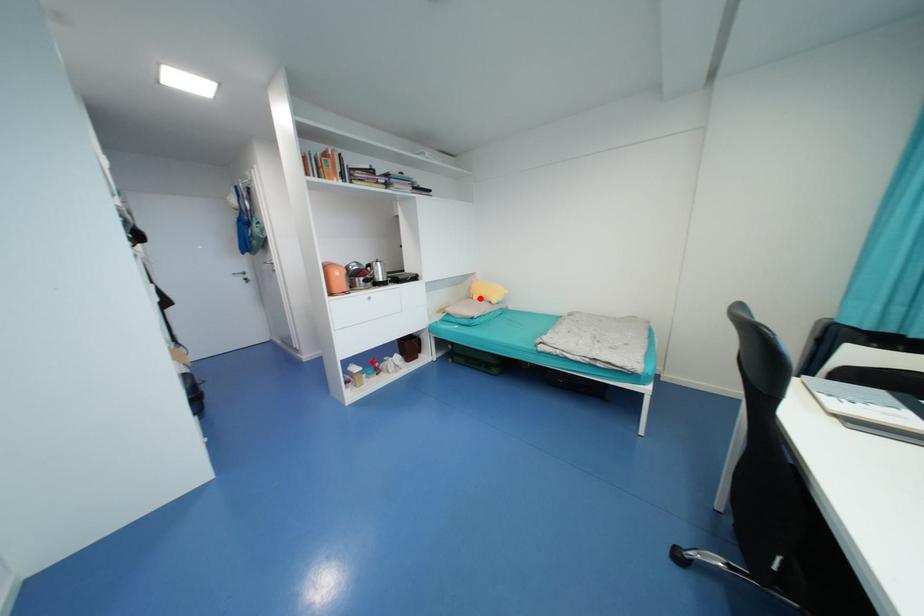
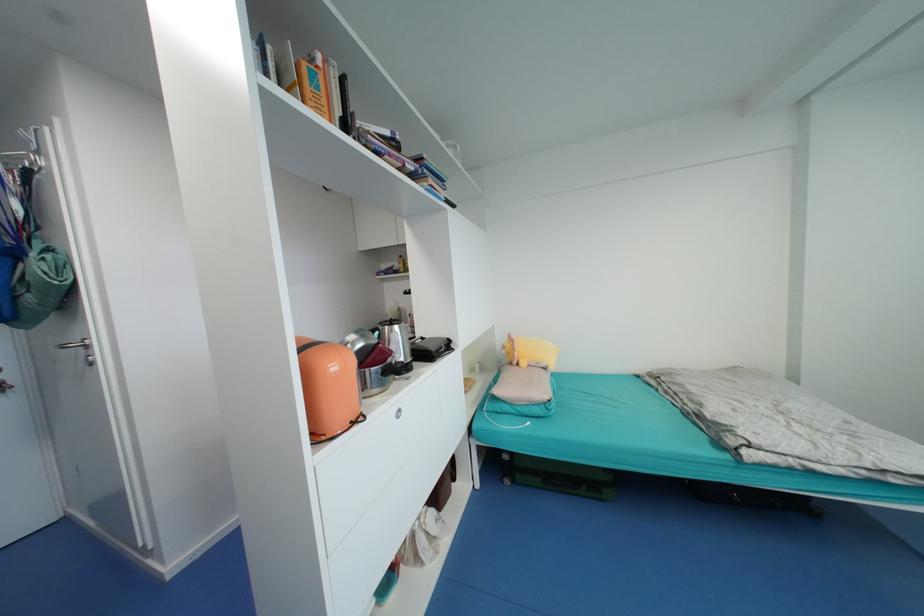
Question: I am providing you with two images of the same scene from different viewpoints. Image1 has a red point marked. In image2, the corresponding 3D location appears at what relative position? Reply with the corresponding letter.

Choices:
 (A) Closer
 (B) Farther

Answer: (B)